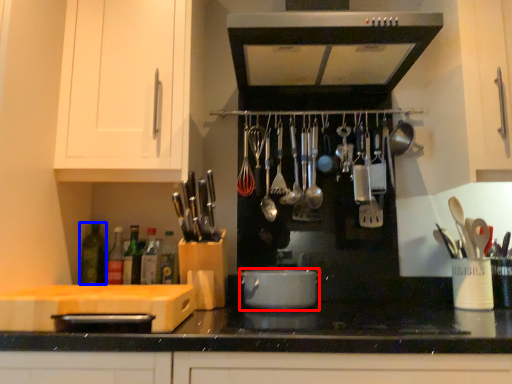
Question: Which object is further to the camera taking this photo, kitchen appliance (highlighted by a red box) or bottle (highlighted by a blue box)?

Choices:
 (A) kitchen appliance
 (B) bottle

Answer: (B)